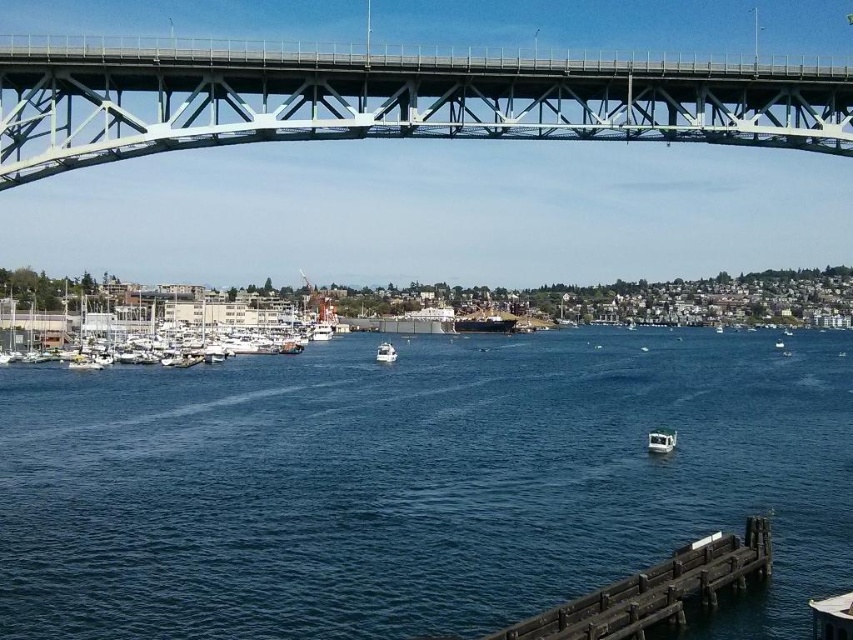
Question: Can you confirm if white matte boats at lower left is positioned below white glossy boat at lower center?

Choices:
 (A) no
 (B) yes

Answer: (A)

Question: Is wooden pier at lower right to the left of white glossy boat at center from the viewer's perspective?

Choices:
 (A) yes
 (B) no

Answer: (B)

Question: Which of the following is the farthest from the observer?

Choices:
 (A) blue water at center
 (B) wooden pier at lower right
 (C) white glossy boat at lower center

Answer: (C)

Question: Can you confirm if gray metallic bridge at upper center is positioned above wooden pier at lower right?

Choices:
 (A) no
 (B) yes

Answer: (B)

Question: Which point is closer to the camera?

Choices:
 (A) gray metallic bridge at upper center
 (B) white glossy boat at lower center
 (C) white glossy boat at center

Answer: (A)

Question: Based on their relative distances, which object is farther from the wooden pier at lower right?

Choices:
 (A) blue water at center
 (B) white glossy boat at lower center
 (C) white glossy boat at center

Answer: (C)